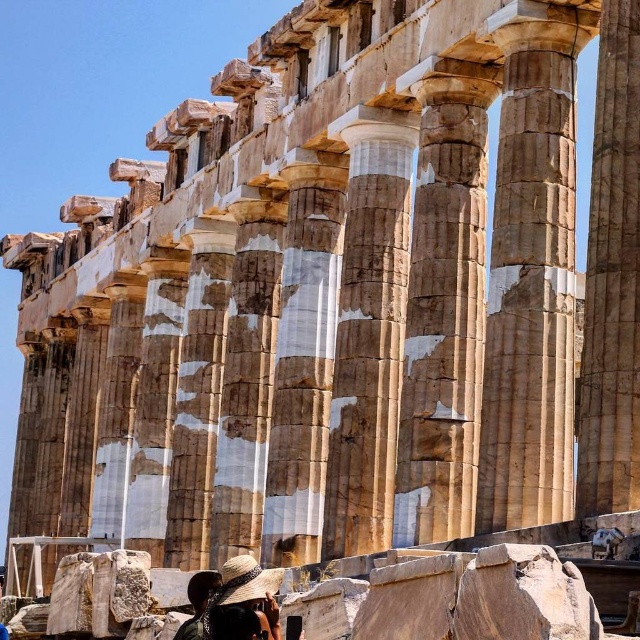
Between point (256, 592) and point (198, 614), which one is positioned behind?

The point (198, 614) is behind.

Is matte straw hat at lower center positioned behind dark brown hair at lower center?

That is False.

Between point (228, 604) and point (204, 579), which one is positioned in front?

Point (228, 604) is in front.

Where is `matte straw hat at lower center`? matte straw hat at lower center is located at coordinates (246, 593).